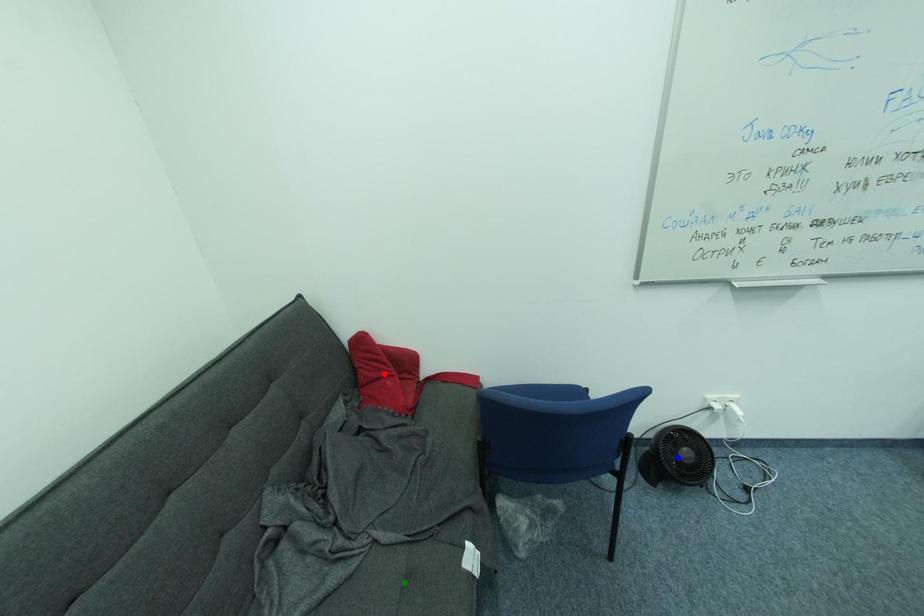
Order these from nearest to farthest:
A) red point
B) green point
C) blue point

blue point
red point
green point